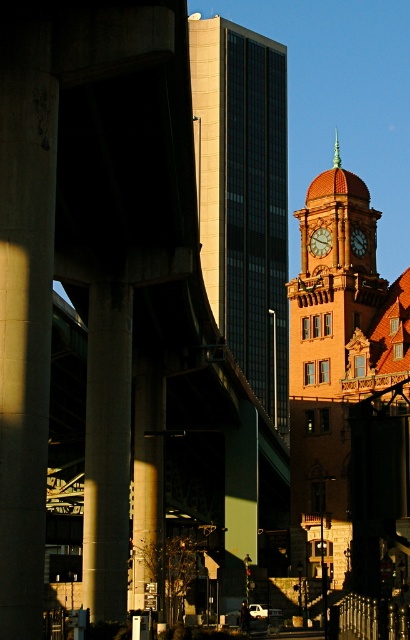
Between matte orange clock tower at center right and metallic pole at center, which one has more height?

matte orange clock tower at center right is taller.

Does matte orange clock tower at center right have a larger size compared to metallic pole at center?

Yes, matte orange clock tower at center right is bigger than metallic pole at center.

Which is behind, point (336, 326) or point (277, 428)?

Positioned behind is point (277, 428).

What are the coordinates of `matte orange clock tower at center right` in the screenshot? It's located at (332, 280).

Does point (2, 289) come in front of point (150, 557)?

Yes, it is in front of point (150, 557).

Which is in front, point (13, 592) or point (138, 372)?

Point (13, 592) is in front.

Between point (2, 525) and point (148, 515), which one is positioned in front?

Point (2, 525) is in front.

You are a GUI agent. You are given a task and a screenshot of the screen. Output one action in this format:
    pyautogui.click(x=<x>, y=<y>)
    Task: Click on the concrete pillar at left
    
    Given the screenshot: What is the action you would take?
    pyautogui.click(x=25, y=337)

What do you see at coordinates (319, 241) in the screenshot?
I see `matte gold clock at center` at bounding box center [319, 241].

Does point (325, 228) come in front of point (355, 241)?

No, it is behind (355, 241).

Image resolution: width=410 pixels, height=640 pixels. Describe the element at coordinates (319, 241) in the screenshot. I see `matte gold clock at center` at that location.

Locate an element on the screen. Image resolution: width=410 pixels, height=640 pixels. matte gold clock at center is located at coordinates (319, 241).